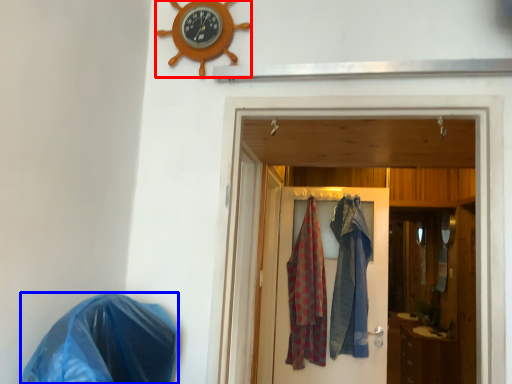
Question: Which object appears closest to the camera in this image, clock (highlighted by a red box) or material (highlighted by a blue box)?

Choices:
 (A) clock
 (B) material

Answer: (B)